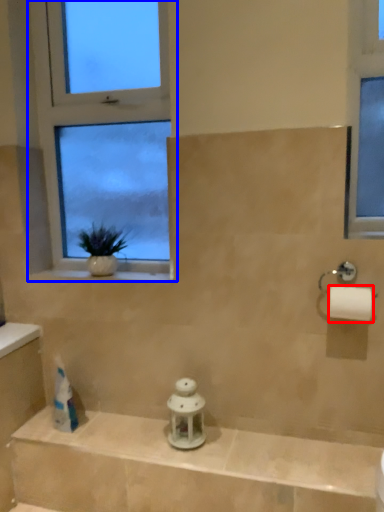
Question: Which of the following is the closest to the observer, toilet paper (highlighted by a red box) or window (highlighted by a blue box)?

Choices:
 (A) toilet paper
 (B) window

Answer: (A)